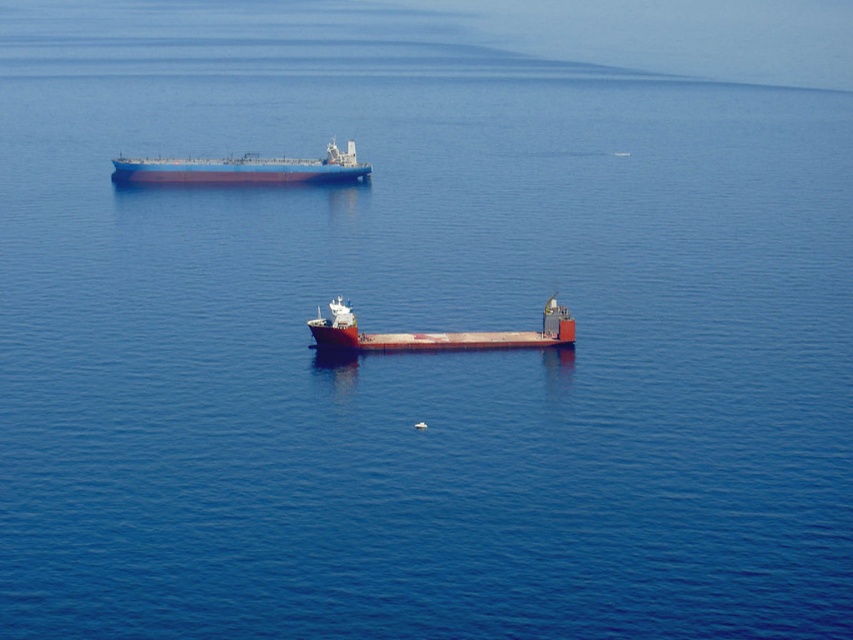
You are a maritime observer trying to determine the relative positions of the ships in the image. Based on the scene, which ship is situated higher in the frame between the blue matte tanker at upper left and the smooth red barge at center?

The blue matte tanker at upper left is positioned over the smooth red barge at center, meaning it is higher in the frame.